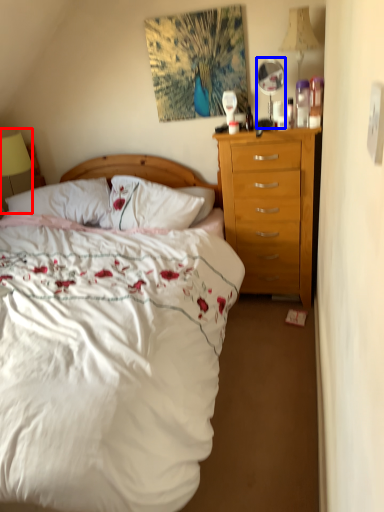
Question: Which object appears closest to the camera in this image, lamp (highlighted by a red box) or mirror (highlighted by a blue box)?

Choices:
 (A) lamp
 (B) mirror

Answer: (B)